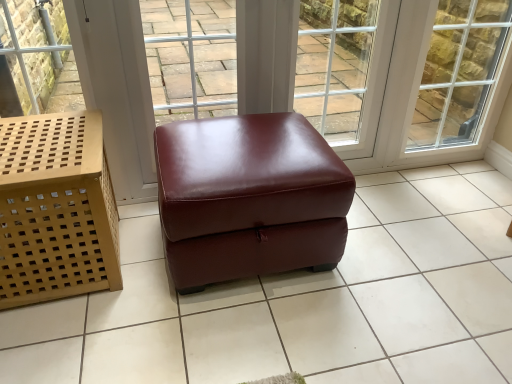
The width and height of the screenshot is (512, 384). Identify the location of free space between light brown woven basket at left and burgundy leather ottoman at center. (138, 270).